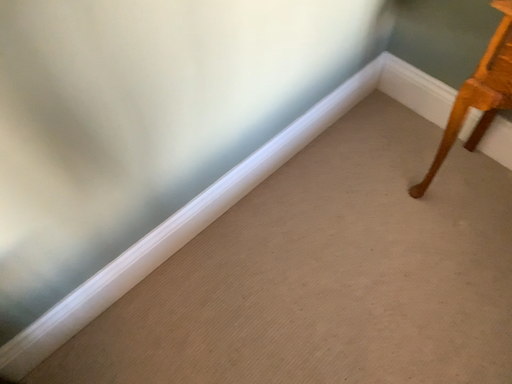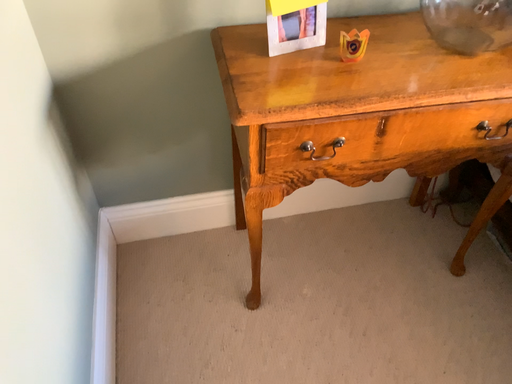
Question: How did the camera likely rotate when shooting the video?

Choices:
 (A) rotated right
 (B) rotated left

Answer: (A)